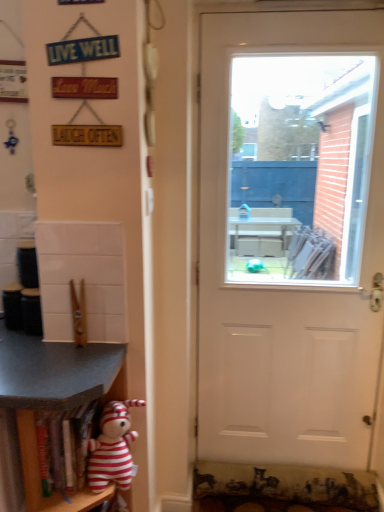
Question: Can you confirm if striped plush toy at lower left is smaller than wooden shelf at lower left, which appears as the 1th shelf when viewed from the left?

Choices:
 (A) yes
 (B) no

Answer: (A)

Question: Can you confirm if striped plush toy at lower left is bigger than wooden shelf at lower left, the second shelf from the right?

Choices:
 (A) no
 (B) yes

Answer: (A)

Question: From a real-world perspective, is striped plush toy at lower left on wooden shelf at lower left, which appears as the 1th shelf when viewed from the left?

Choices:
 (A) yes
 (B) no

Answer: (A)

Question: Considering the relative positions of striped plush toy at lower left and wooden shelf at lower left, which appears as the 1th shelf when viewed from the left, in the image provided, is striped plush toy at lower left to the right of wooden shelf at lower left, which appears as the 1th shelf when viewed from the left, from the viewer's perspective?

Choices:
 (A) no
 (B) yes

Answer: (B)

Question: Does striped plush toy at lower left appear on the left side of wooden shelf at lower left, which appears as the 1th shelf when viewed from the left?

Choices:
 (A) no
 (B) yes

Answer: (A)

Question: Is point (319, 34) positioned closer to the camera than point (74, 350)?

Choices:
 (A) closer
 (B) farther

Answer: (B)

Question: Considering the positions of white matte door at center and wooden shelf at lower left, the second shelf from the right, in the image, is white matte door at center wider or thinner than wooden shelf at lower left, the second shelf from the right,?

Choices:
 (A) thin
 (B) wide

Answer: (A)

Question: From the image's perspective, is white matte door at center above or below wooden shelf at lower left, which appears as the 1th shelf when viewed from the left?

Choices:
 (A) above
 (B) below

Answer: (A)

Question: In the image, is white matte door at center positioned in front of or behind wooden shelf at lower left, the second shelf from the right?

Choices:
 (A) behind
 (B) front

Answer: (A)

Question: Is point (112, 431) positioned closer to the camera than point (97, 395)?

Choices:
 (A) farther
 (B) closer

Answer: (A)

Question: Considering the positions of striped plush toy at lower left and wooden shelf at lower left, which appears as the 1th shelf when viewed from the left, in the image, is striped plush toy at lower left taller or shorter than wooden shelf at lower left, which appears as the 1th shelf when viewed from the left,?

Choices:
 (A) short
 (B) tall

Answer: (A)

Question: From the image's perspective, is striped plush toy at lower left above or below wooden shelf at lower left, the second shelf from the right?

Choices:
 (A) above
 (B) below

Answer: (A)

Question: Is striped plush toy at lower left situated inside wooden shelf at lower left, the second shelf from the right, or outside?

Choices:
 (A) outside
 (B) inside

Answer: (B)

Question: Would you say wooden shelf at lower left, which appears as the 1th shelf when viewed from the left, is inside or outside wooden bookshelf at lower left, arranged as the second shelf when viewed from the left?

Choices:
 (A) outside
 (B) inside

Answer: (A)

Question: Is wooden shelf at lower left, which appears as the 1th shelf when viewed from the left, to the left or to the right of wooden bookshelf at lower left, arranged as the second shelf when viewed from the left, in the image?

Choices:
 (A) right
 (B) left

Answer: (B)